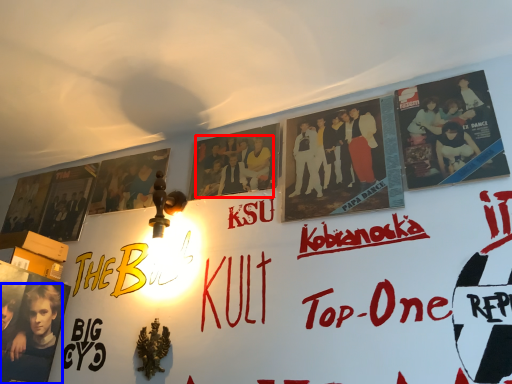
Question: Which object is closer to the camera taking this photo, person (highlighted by a red box) or person (highlighted by a blue box)?

Choices:
 (A) person
 (B) person

Answer: (B)